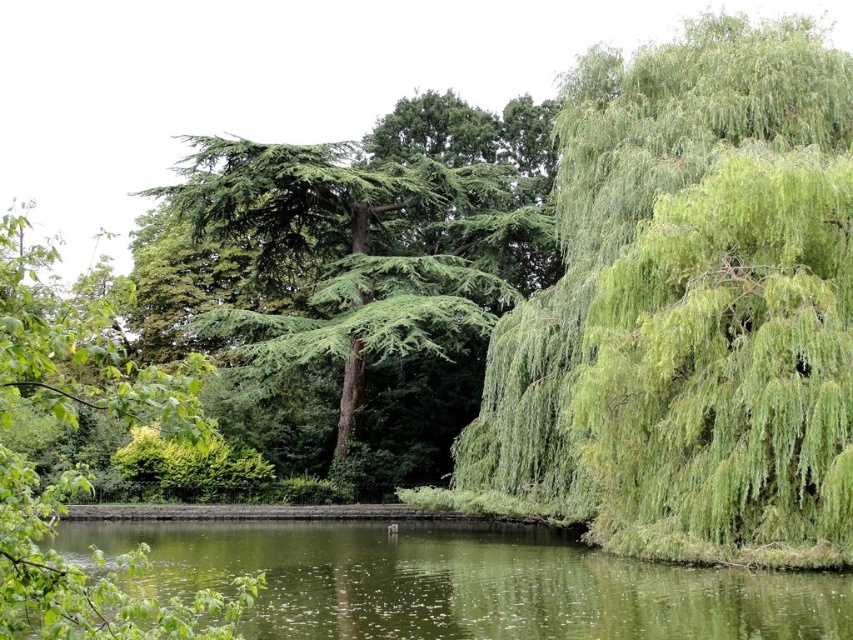
Question: Which object is farther from the camera taking this photo?

Choices:
 (A) green leafy willow at right
 (B) green liquid water at center

Answer: (A)

Question: Does green liquid water at center appear on the left side of green textured tree at upper left?

Choices:
 (A) yes
 (B) no

Answer: (B)

Question: Which of the following is the farthest from the observer?

Choices:
 (A) (538, 625)
 (B) (415, 196)

Answer: (B)

Question: Does green liquid water at center have a smaller size compared to green textured tree at upper left?

Choices:
 (A) no
 (B) yes

Answer: (B)

Question: Which object is closer to the camera taking this photo?

Choices:
 (A) green liquid water at center
 (B) green textured tree at upper left

Answer: (B)

Question: Does green leafy willow at right lie behind green textured tree at upper left?

Choices:
 (A) yes
 (B) no

Answer: (A)